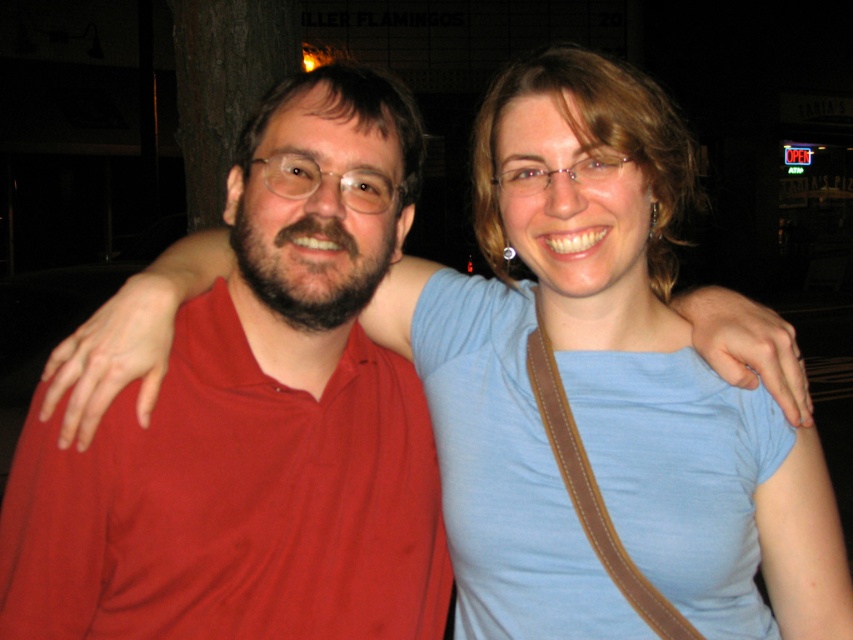
Question: Which object appears closest to the camera in this image?

Choices:
 (A) blue cotton shirt at upper right
 (B) matte red shirt at left

Answer: (B)

Question: Considering the relative positions of blue cotton shirt at upper right and matte red shirt at left in the image provided, where is blue cotton shirt at upper right located with respect to matte red shirt at left?

Choices:
 (A) left
 (B) right

Answer: (B)

Question: Can you confirm if blue cotton shirt at upper right is wider than matte red shirt at left?

Choices:
 (A) yes
 (B) no

Answer: (A)

Question: Is blue cotton shirt at upper right thinner than matte red shirt at left?

Choices:
 (A) yes
 (B) no

Answer: (B)